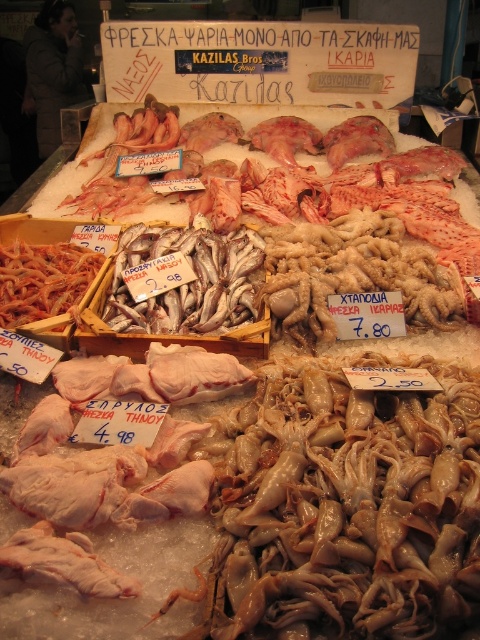
Question: Where is white fish at center located in relation to white raw squid at center in the image?

Choices:
 (A) right
 (B) left

Answer: (A)

Question: Which point appears closest to the camera in this image?

Choices:
 (A) 207,262
 (B) 84,257

Answer: (A)

Question: Where is white fish at center located in relation to white raw squid at center in the image?

Choices:
 (A) left
 (B) right

Answer: (B)

Question: Can you confirm if white fish at center is positioned above white raw squid at center?

Choices:
 (A) no
 (B) yes

Answer: (B)

Question: Which of the following is the closest to the observer?

Choices:
 (A) white raw squid at center
 (B) white fish at center

Answer: (A)

Question: Among these points, which one is farthest from the camera?

Choices:
 (A) (165, 292)
 (B) (34, 292)

Answer: (B)